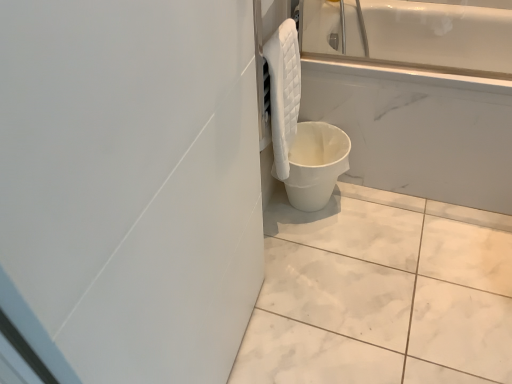
Question: Based on their positions, is white matte bucket at lower right located to the left or right of white marble tile at lower center?

Choices:
 (A) left
 (B) right

Answer: (A)

Question: Considering the positions of white matte bucket at lower right and white marble tile at lower center in the image, is white matte bucket at lower right bigger or smaller than white marble tile at lower center?

Choices:
 (A) big
 (B) small

Answer: (A)

Question: Estimate the real-world distances between objects in this image. Which object is farther from the white quilted towel at upper right?

Choices:
 (A) white marble tile at lower center
 (B) white matte bucket at lower right

Answer: (A)

Question: Estimate the real-world distances between objects in this image. Which object is farther from the white marble tile at lower center?

Choices:
 (A) white matte bucket at lower right
 (B) white quilted towel at upper right

Answer: (B)